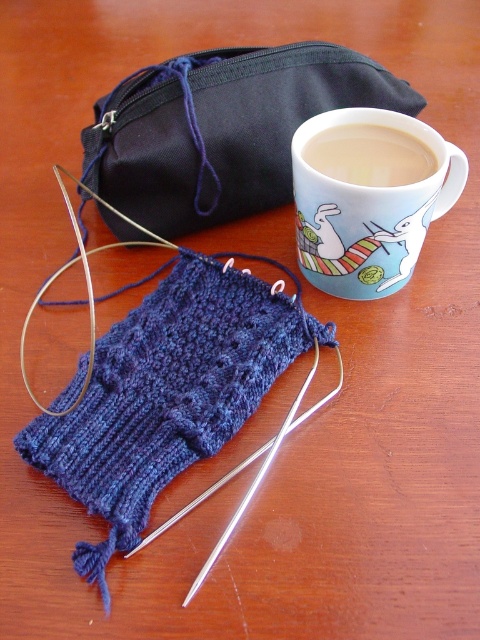
Question: Which point is closer to the camera?

Choices:
 (A) (345, 147)
 (B) (238, 385)

Answer: (B)

Question: Can you confirm if matte ceramic mug at upper right is wider than matte ceramic mug at upper center?

Choices:
 (A) no
 (B) yes

Answer: (B)

Question: Among these points, which one is farthest from the camera?

Choices:
 (A) (316, 172)
 (B) (84, 381)
 (C) (121, 150)
 (D) (321, 168)

Answer: (C)

Question: From the image, what is the correct spatial relationship of matte black pouch at upper center in relation to matte ceramic mug at upper right?

Choices:
 (A) right
 (B) left

Answer: (B)

Question: Which object is positioned closest to the black fabric pouch at upper center?

Choices:
 (A) matte ceramic mug at upper center
 (B) matte black pouch at upper center

Answer: (A)

Question: Is black fabric pouch at upper center bigger than matte ceramic mug at upper right?

Choices:
 (A) yes
 (B) no

Answer: (A)